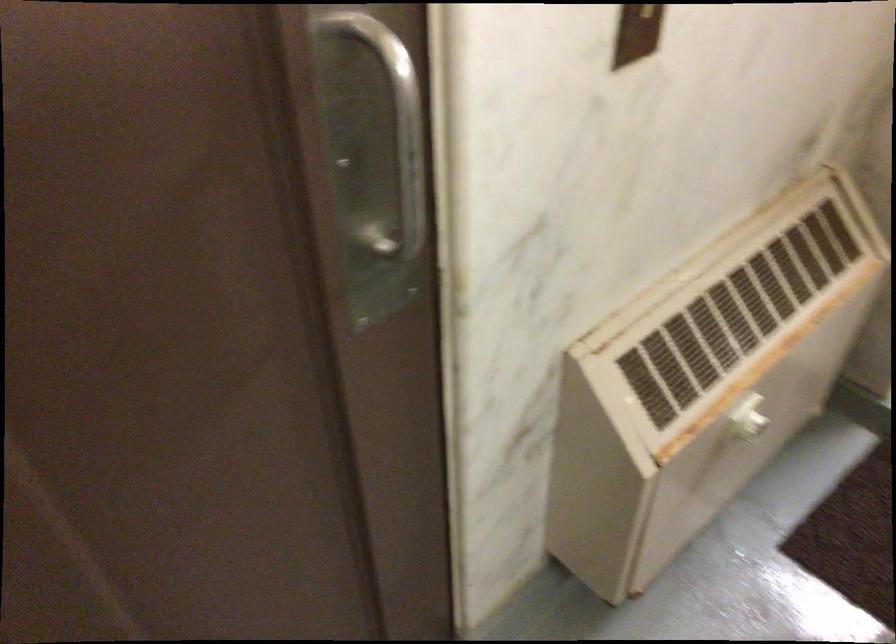
Find where to turn the white radiator knob. Please return your answer as a coordinate pair (x, y).

(746, 418)